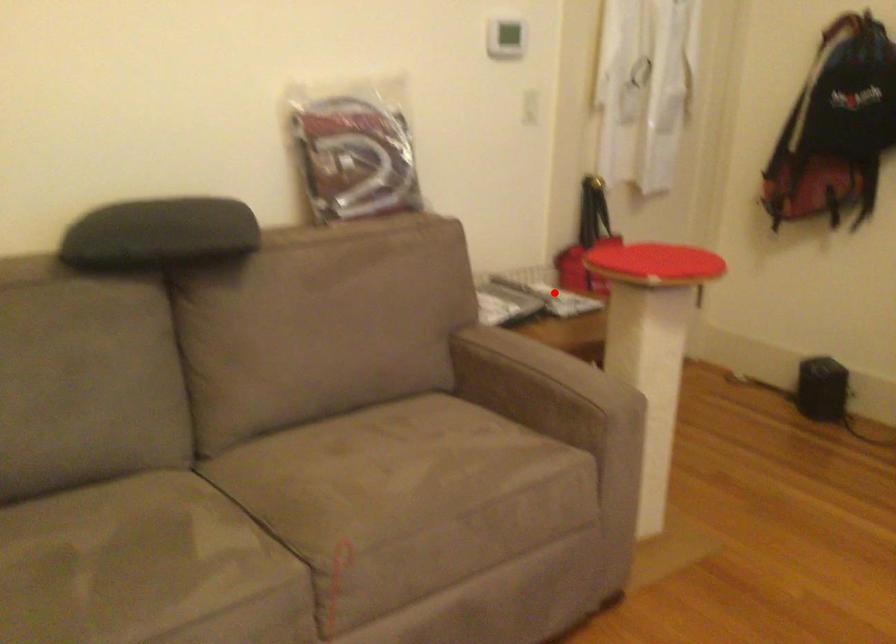
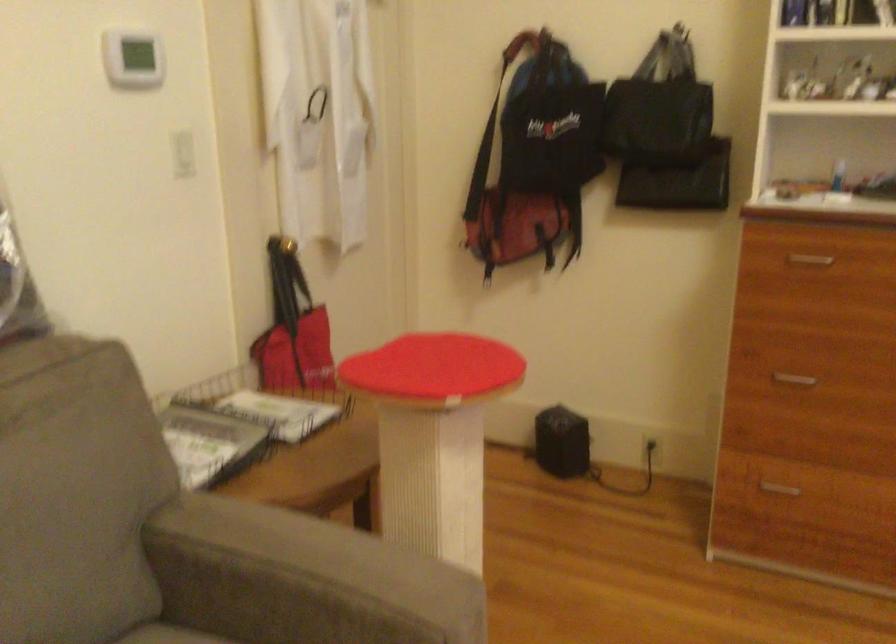
Question: I am providing you with two images of the same scene from different viewpoints. A red point is shown in image1. For the corresponding object point in image2, is it positioned nearer or farther from the camera?

Choices:
 (A) Nearer
 (B) Farther

Answer: (A)